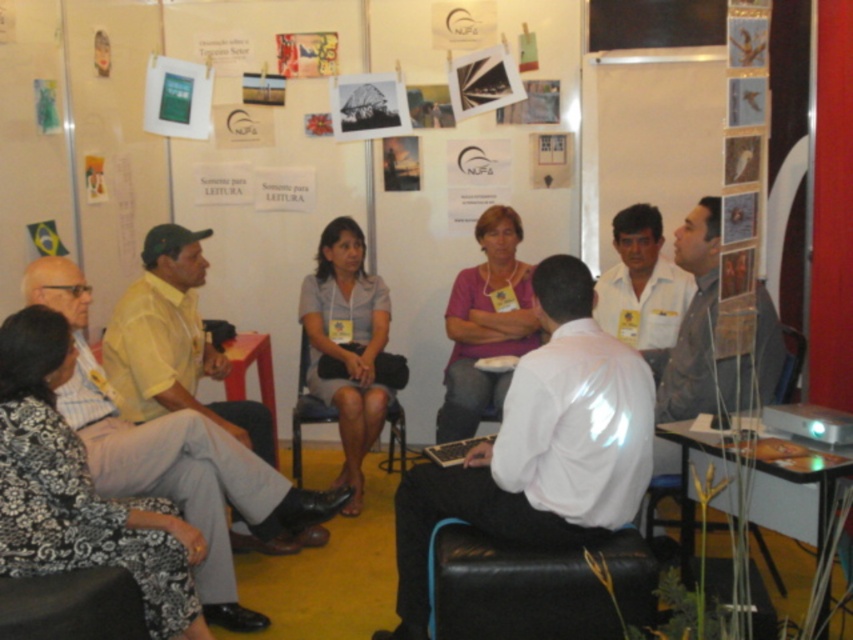
Question: In this image, where is pink fabric shirt at center located relative to white shirt at center?

Choices:
 (A) right
 (B) left

Answer: (B)

Question: Which point is farther to the camera?

Choices:
 (A) white glossy shirt at center
 (B) pink fabric shirt at center

Answer: (B)

Question: Which is farther from the gray fabric skirt at center?

Choices:
 (A) white glossy shirt at center
 (B) metallic gold frame at upper right

Answer: (B)

Question: Is white glossy shirt at center to the left of gray fabric skirt at center from the viewer's perspective?

Choices:
 (A) yes
 (B) no

Answer: (B)

Question: Can you confirm if white glossy shirt at center is bigger than wooden chair at lower right?

Choices:
 (A) yes
 (B) no

Answer: (A)

Question: Which point appears farthest from the camera in this image?

Choices:
 (A) (489, 269)
 (B) (44, 289)
 (C) (351, 401)

Answer: (A)